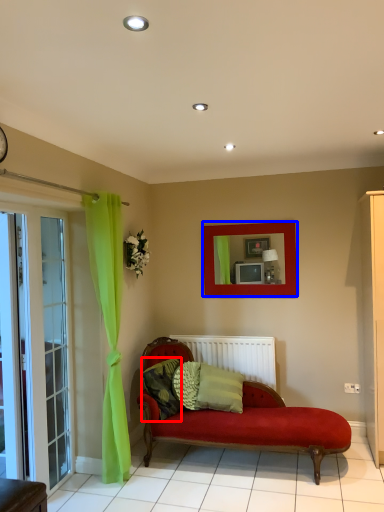
Question: Among these objects, which one is nearest to the camera, pillow (highlighted by a red box) or picture frame (highlighted by a blue box)?

Choices:
 (A) pillow
 (B) picture frame

Answer: (A)